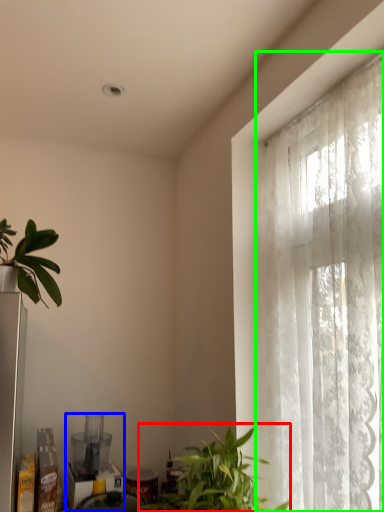
Question: Which object is the farthest from houseplant (highlighted by a red box)? Choose among these: appliance (highlighted by a blue box) or window (highlighted by a green box).

Choices:
 (A) appliance
 (B) window

Answer: (A)